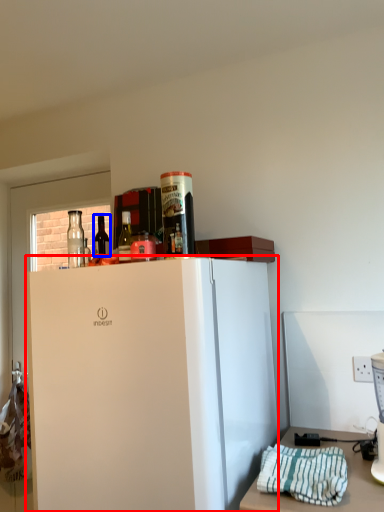
Question: Among these objects, which one is farthest to the camera, refrigerator (highlighted by a red box) or bottle (highlighted by a blue box)?

Choices:
 (A) refrigerator
 (B) bottle

Answer: (B)